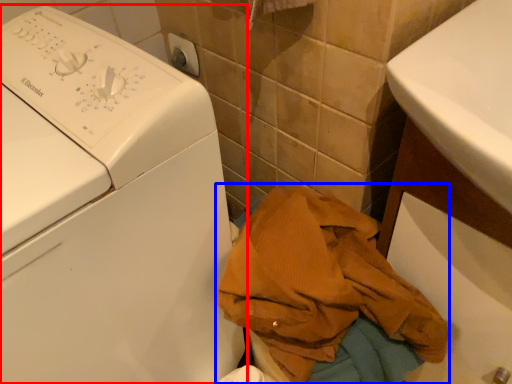
Question: Among these objects, which one is farthest to the camera, washing machine (highlighted by a red box) or clothing (highlighted by a blue box)?

Choices:
 (A) washing machine
 (B) clothing

Answer: (B)